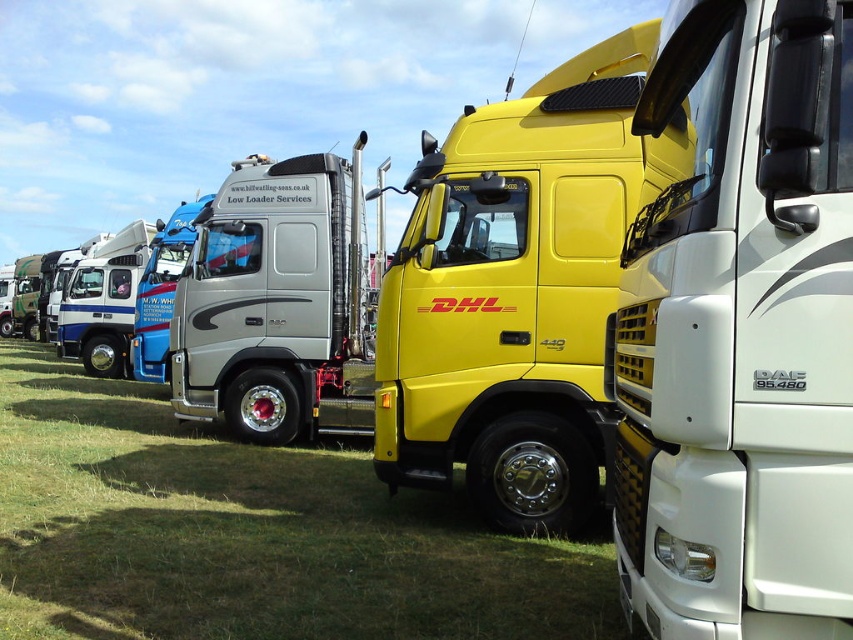
Question: Estimate the real-world distances between objects in this image. Which object is closer to the white glossy trailer truck at center?

Choices:
 (A) yellow matte truck at center
 (B) green grass at center

Answer: (A)

Question: Which point is farther from the camera taking this photo?

Choices:
 (A) (529, 435)
 (B) (799, 193)
 (C) (169, 612)
 (D) (231, 368)

Answer: (D)

Question: Is green grass at center to the left of yellow matte truck at center from the viewer's perspective?

Choices:
 (A) no
 (B) yes

Answer: (B)

Question: Which object appears closest to the camera in this image?

Choices:
 (A) green grass at center
 (B) yellow matte truck at center
 (C) silver metallic truck at center

Answer: (B)

Question: Can you confirm if green grass at center is positioned to the left of yellow matte truck at center?

Choices:
 (A) yes
 (B) no

Answer: (A)

Question: Is white glossy trailer truck at center to the left of green grass at center from the viewer's perspective?

Choices:
 (A) yes
 (B) no

Answer: (B)